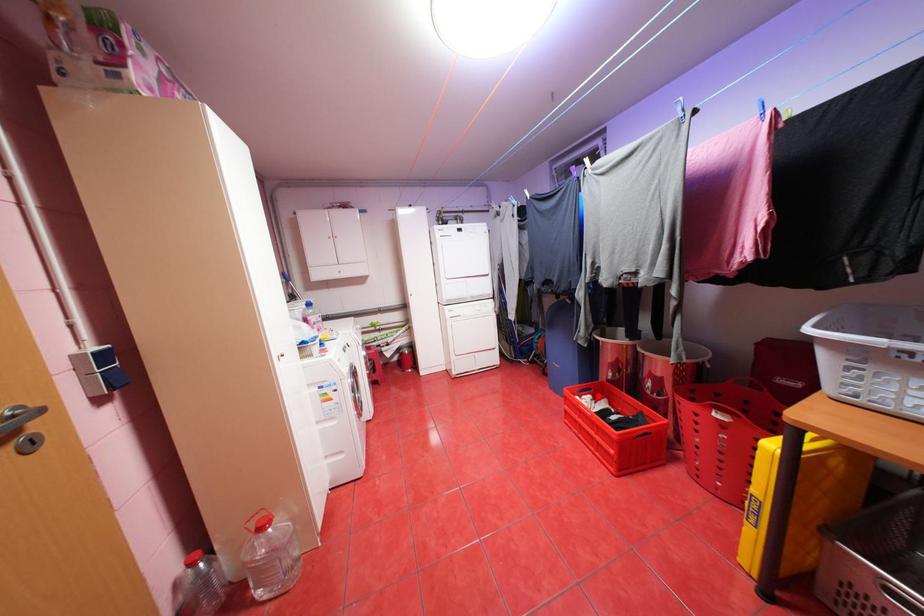
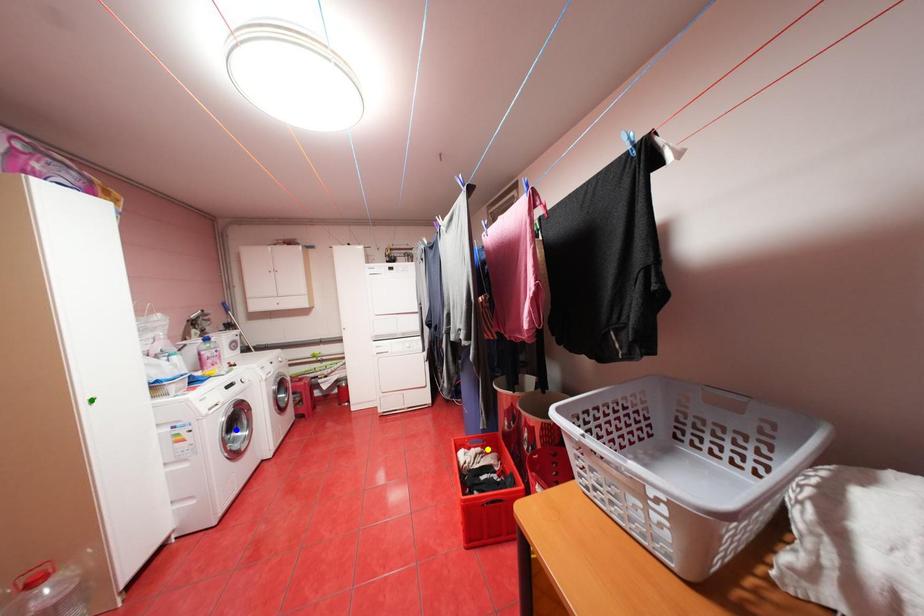
Question: I am providing you with two images of the same scene from different viewpoints. A red point is marked on the first image. You are given multiple points on the second image. Can you choose the point in image 2 that corresponds to the point in image 1?

Choices:
 (A) blue point
 (B) green point
 (C) yellow point

Answer: (C)